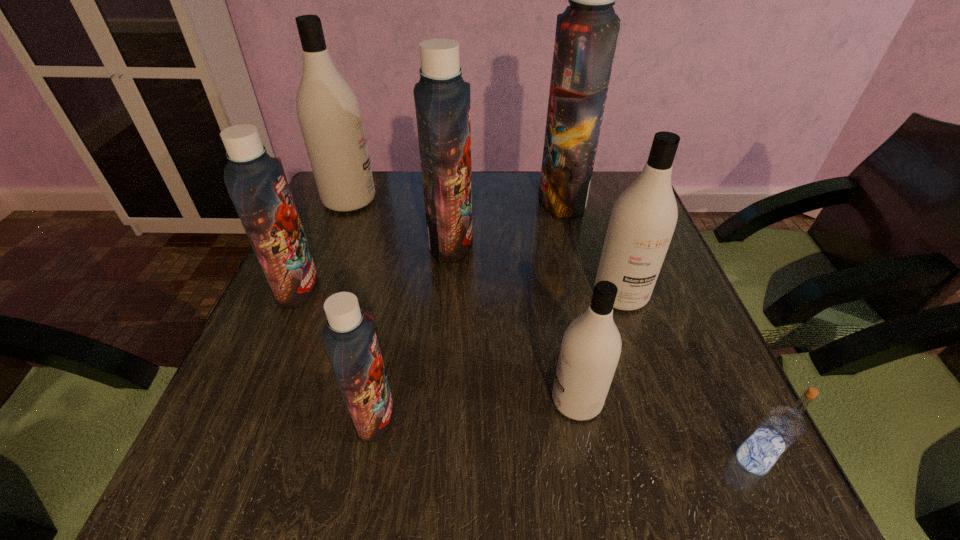
Point out which white shampoo is positioned as the second nearest to the rightmost object. Please provide its 2D coordinates. Your answer should be formatted as a tuple, i.e. [(x, y)], where the tuple contains the x and y coordinates of a point satisfying the conditions above.

[(643, 219)]

Where is `white shampoo that stands as the closest to the tallest shampoo`? white shampoo that stands as the closest to the tallest shampoo is located at coordinates (643, 219).

The width and height of the screenshot is (960, 540). Identify the location of free location that satisfies the following two spatial constraints: 1. on the front-facing side of the rightmost white shampoo; 2. on the front label of the smallest blue shampoo. (660, 415).

Locate an element on the screen. vacant space that satisfies the following two spatial constraints: 1. on the back side of the rightmost object; 2. on the front label of the third biggest blue shampoo is located at coordinates (673, 288).

Find the location of a particular element. vacant position in the image that satisfies the following two spatial constraints: 1. on the back side of the shortest object; 2. on the front label of the second blue shampoo from left to right is located at coordinates (732, 415).

The height and width of the screenshot is (540, 960). I want to click on free space in the image that satisfies the following two spatial constraints: 1. on the front-facing side of the rightmost object; 2. on the right side of the farthest white shampoo, so click(x=249, y=461).